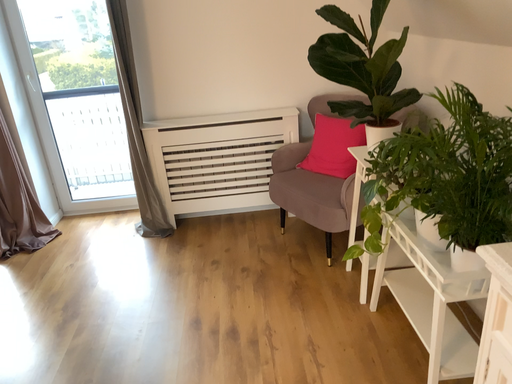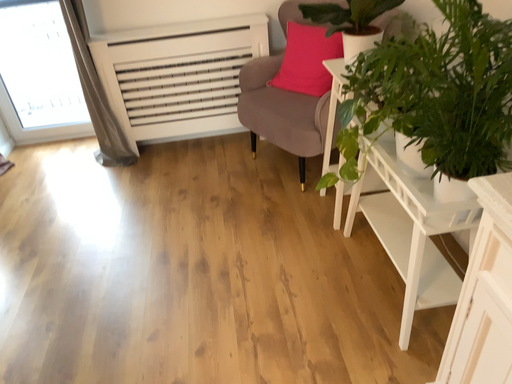
Question: How did the camera likely rotate when shooting the video?

Choices:
 (A) rotated downward
 (B) rotated upward

Answer: (A)